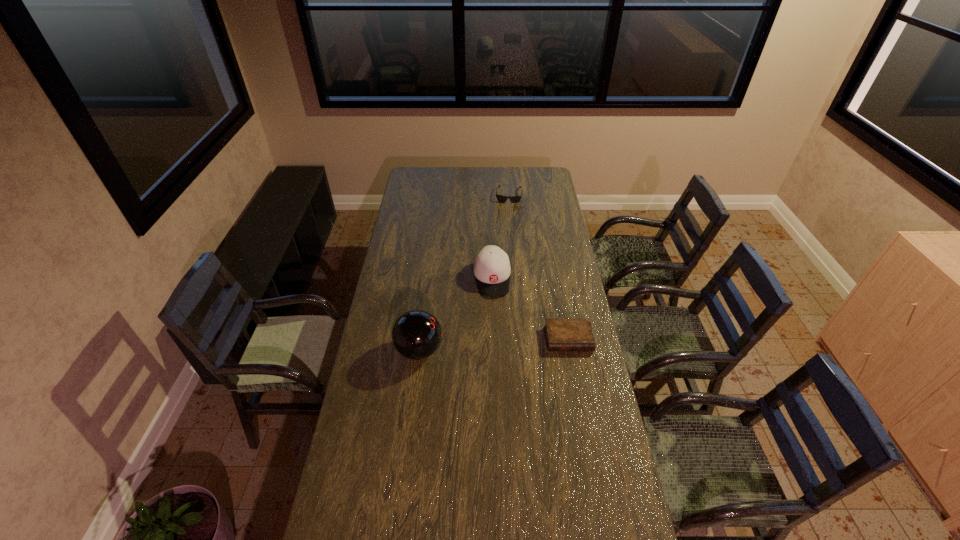
This screenshot has height=540, width=960. I want to click on the leftmost object, so click(416, 334).

I want to click on the tallest object, so click(416, 334).

Locate an element on the screen. This screenshot has height=540, width=960. diary is located at coordinates (562, 334).

Where is `the farthest object`? The width and height of the screenshot is (960, 540). the farthest object is located at coordinates (514, 199).

I want to click on the third nearest object, so click(x=491, y=267).

Where is `the third shortest object`? the third shortest object is located at coordinates (491, 267).

The image size is (960, 540). What are the coordinates of `vacant space situated on the surface of the bowling ball near the finger holes` in the screenshot? It's located at (506, 350).

In order to click on free spot located on the spine side of the rightmost object in this screenshot , I will do `click(579, 393)`.

Where is `free point located 0.210m on the front-facing side of the farthest object`? free point located 0.210m on the front-facing side of the farthest object is located at coordinates (506, 225).

The height and width of the screenshot is (540, 960). I want to click on free space located 0.150m on the front-facing side of the farthest object, so click(x=506, y=219).